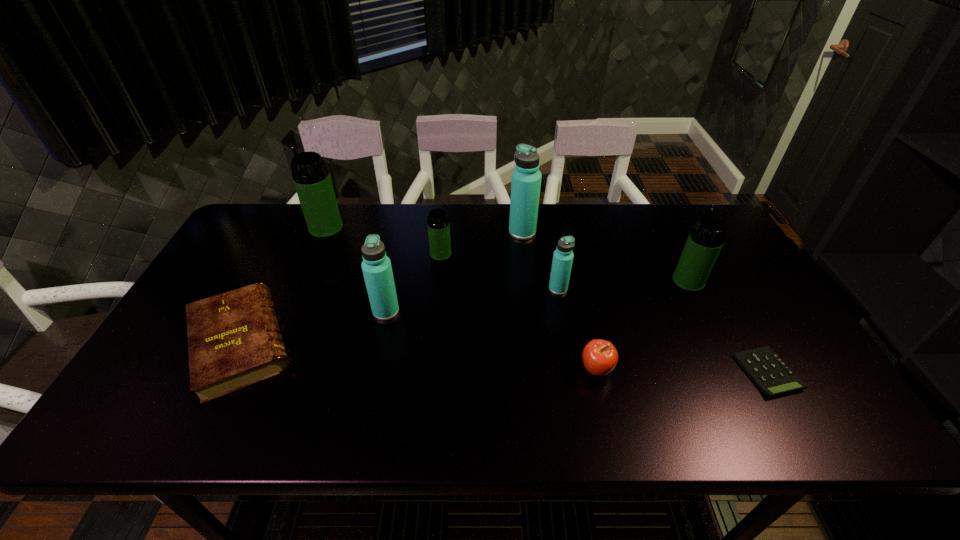
At what (x,y) coordinates should I click in order to perform the action: click on the biggest green thermos bottle. Please return your answer as a coordinate pair (x, y). Image resolution: width=960 pixels, height=540 pixels. Looking at the image, I should click on (311, 177).

Identify the location of the farthest green thermos bottle. (311, 177).

Locate an element on the screen. The image size is (960, 540). the second aqua thermos bottle from right to left is located at coordinates (526, 179).

The width and height of the screenshot is (960, 540). What are the coordinates of `the farthest aqua thermos bottle` in the screenshot? It's located at (526, 179).

Locate an element on the screen. This screenshot has height=540, width=960. the second smallest green thermos bottle is located at coordinates [x=707, y=237].

This screenshot has width=960, height=540. Find the location of `the rightmost thermos bottle`. the rightmost thermos bottle is located at coordinates (707, 237).

The image size is (960, 540). In order to click on the leftmost aqua thermos bottle in this screenshot , I will do `click(376, 266)`.

Locate an element on the screen. The width and height of the screenshot is (960, 540). the second smallest aqua thermos bottle is located at coordinates (376, 266).

Locate an element on the screen. The width and height of the screenshot is (960, 540). the fourth object from left to right is located at coordinates (438, 225).

This screenshot has height=540, width=960. What are the coordinates of `the smallest green thermos bottle` in the screenshot? It's located at (438, 225).